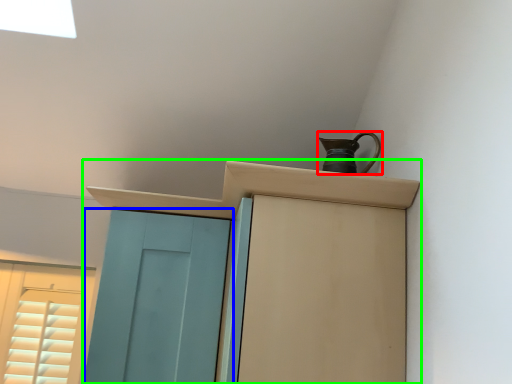
Question: Which is farther away from jug (highlighted by a red box)? door (highlighted by a blue box) or cupboard (highlighted by a green box)?

Choices:
 (A) door
 (B) cupboard

Answer: (A)